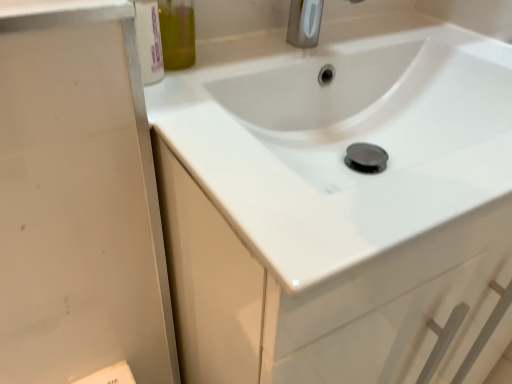
Question: Does olive green glass bottle at upper left have a smaller size compared to satin nickel faucet at upper center?

Choices:
 (A) yes
 (B) no

Answer: (A)

Question: Is olive green glass bottle at upper left beside satin nickel faucet at upper center?

Choices:
 (A) no
 (B) yes

Answer: (A)

Question: Is olive green glass bottle at upper left located outside satin nickel faucet at upper center?

Choices:
 (A) no
 (B) yes

Answer: (B)

Question: Considering the relative sizes of olive green glass bottle at upper left and satin nickel faucet at upper center in the image provided, is olive green glass bottle at upper left wider than satin nickel faucet at upper center?

Choices:
 (A) yes
 (B) no

Answer: (B)

Question: Considering the relative sizes of olive green glass bottle at upper left and satin nickel faucet at upper center in the image provided, is olive green glass bottle at upper left taller than satin nickel faucet at upper center?

Choices:
 (A) yes
 (B) no

Answer: (A)

Question: Could you tell me if olive green glass bottle at upper left is turned towards satin nickel faucet at upper center?

Choices:
 (A) yes
 (B) no

Answer: (B)

Question: Is white glossy sink at center smaller than satin nickel faucet at upper center?

Choices:
 (A) yes
 (B) no

Answer: (B)

Question: From a real-world perspective, does white glossy sink at center sit lower than satin nickel faucet at upper center?

Choices:
 (A) no
 (B) yes

Answer: (B)

Question: From a real-world perspective, is white glossy sink at center on top of satin nickel faucet at upper center?

Choices:
 (A) no
 (B) yes

Answer: (A)

Question: Is white glossy sink at center thinner than satin nickel faucet at upper center?

Choices:
 (A) yes
 (B) no

Answer: (B)

Question: Is white glossy sink at center turned away from satin nickel faucet at upper center?

Choices:
 (A) yes
 (B) no

Answer: (B)

Question: Is the depth of white glossy sink at center greater than that of satin nickel faucet at upper center?

Choices:
 (A) yes
 (B) no

Answer: (B)

Question: Is satin nickel faucet at upper center completely or partially outside of olive green glass bottle at upper left?

Choices:
 (A) yes
 (B) no

Answer: (A)